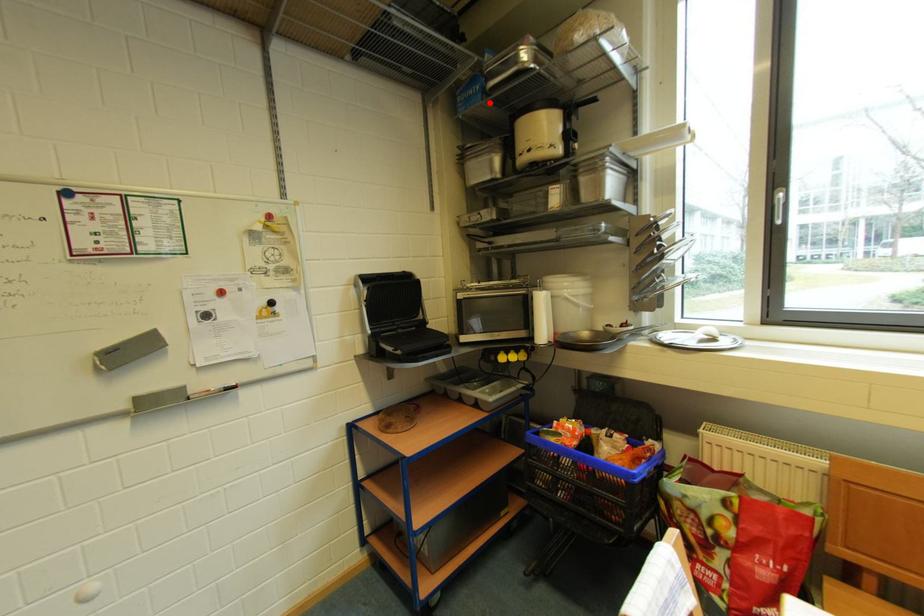
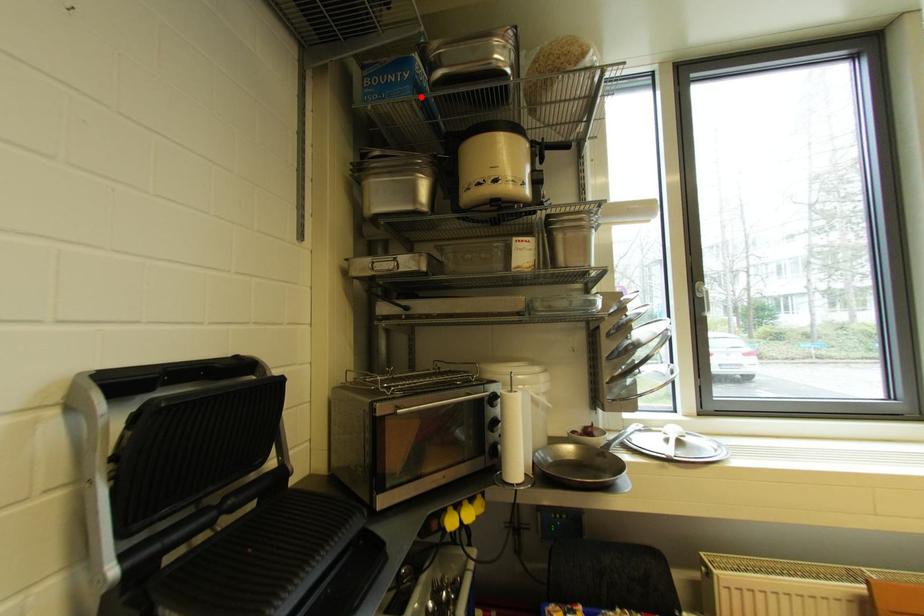
I am providing you with two images of the same scene from different viewpoints. A red point is marked on the first image and another point is marked on the second image. Is the red point in image1 aligned with the point shown in image2?

Yes